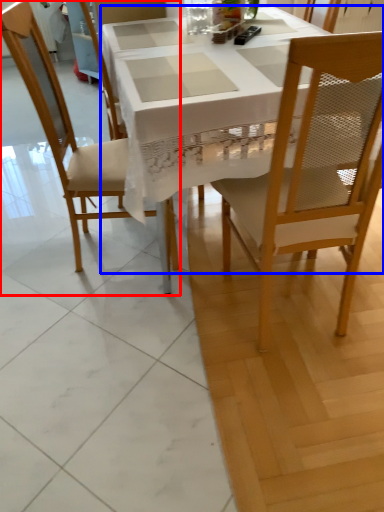
Question: Which point is closer to the camera, chair (highlighted by a red box) or desk (highlighted by a blue box)?

Choices:
 (A) chair
 (B) desk

Answer: (B)